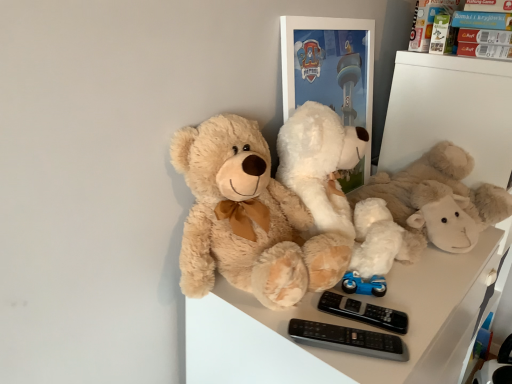
Question: Does black plastic remote controls at lower center come behind black plastic remote at lower right?

Choices:
 (A) yes
 (B) no

Answer: (B)

Question: Does black plastic remote controls at lower center have a smaller size compared to black plastic remote at lower right?

Choices:
 (A) yes
 (B) no

Answer: (B)

Question: Considering the relative sizes of black plastic remote controls at lower center and black plastic remote at lower right in the image provided, is black plastic remote controls at lower center bigger than black plastic remote at lower right?

Choices:
 (A) no
 (B) yes

Answer: (B)

Question: Considering the relative positions of black plastic remote controls at lower center and black plastic remote at lower right in the image provided, is black plastic remote controls at lower center to the left of black plastic remote at lower right from the viewer's perspective?

Choices:
 (A) no
 (B) yes

Answer: (B)

Question: Is black plastic remote controls at lower center not close to black plastic remote at lower right?

Choices:
 (A) yes
 (B) no

Answer: (B)

Question: Considering the relative sizes of black plastic remote controls at lower center and black plastic remote at lower right in the image provided, is black plastic remote controls at lower center wider than black plastic remote at lower right?

Choices:
 (A) yes
 (B) no

Answer: (A)

Question: Does white plush toy at center, which appears as the first teddy bear when viewed from the right, have a lesser height compared to fluffy beige teddy bear at center, positioned as the second teddy bear in right-to-left order?

Choices:
 (A) no
 (B) yes

Answer: (B)

Question: Considering the relative positions of white plush toy at center, which appears as the first teddy bear when viewed from the right, and fluffy beige teddy bear at center, the first teddy bear in the left-to-right sequence, in the image provided, is white plush toy at center, which appears as the first teddy bear when viewed from the right, to the left of fluffy beige teddy bear at center, the first teddy bear in the left-to-right sequence, from the viewer's perspective?

Choices:
 (A) yes
 (B) no

Answer: (B)

Question: From a real-world perspective, is white plush toy at center, which appears as the second teddy bear when viewed from the left, physically above fluffy beige teddy bear at center, positioned as the second teddy bear in right-to-left order?

Choices:
 (A) yes
 (B) no

Answer: (B)

Question: Is white plush toy at center, which appears as the first teddy bear when viewed from the right, to the right of fluffy beige teddy bear at center, the first teddy bear in the left-to-right sequence, from the viewer's perspective?

Choices:
 (A) no
 (B) yes

Answer: (B)

Question: Would you say white plush toy at center, which appears as the first teddy bear when viewed from the right, contains fluffy beige teddy bear at center, the first teddy bear in the left-to-right sequence?

Choices:
 (A) yes
 (B) no

Answer: (B)

Question: Is white plush toy at center, which appears as the second teddy bear when viewed from the left, aimed at fluffy beige teddy bear at center, positioned as the second teddy bear in right-to-left order?

Choices:
 (A) yes
 (B) no

Answer: (B)

Question: Would you say black plastic remote controls at lower center is a long distance from matte cardboard box at upper right?

Choices:
 (A) yes
 (B) no

Answer: (B)